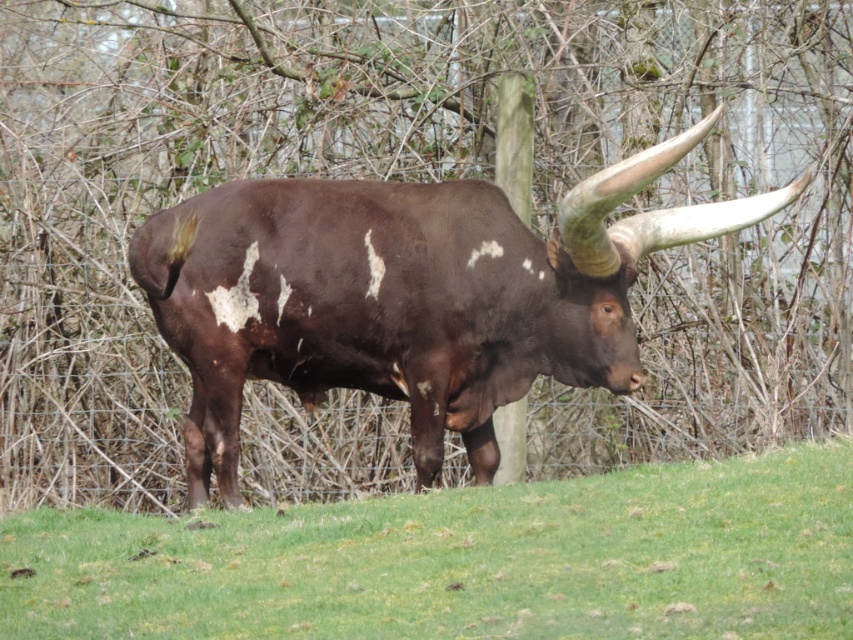
Between point (787, 536) and point (424, 477), which one is positioned behind?

Positioned behind is point (424, 477).

Is green grass at center further to camera compared to brown glossy bull at center?

No, it is not.

Does point (757, 600) lie in front of point (596, 353)?

Yes, point (757, 600) is in front of point (596, 353).

Image resolution: width=853 pixels, height=640 pixels. In order to click on green grass at center in this screenshot , I will do `click(463, 561)`.